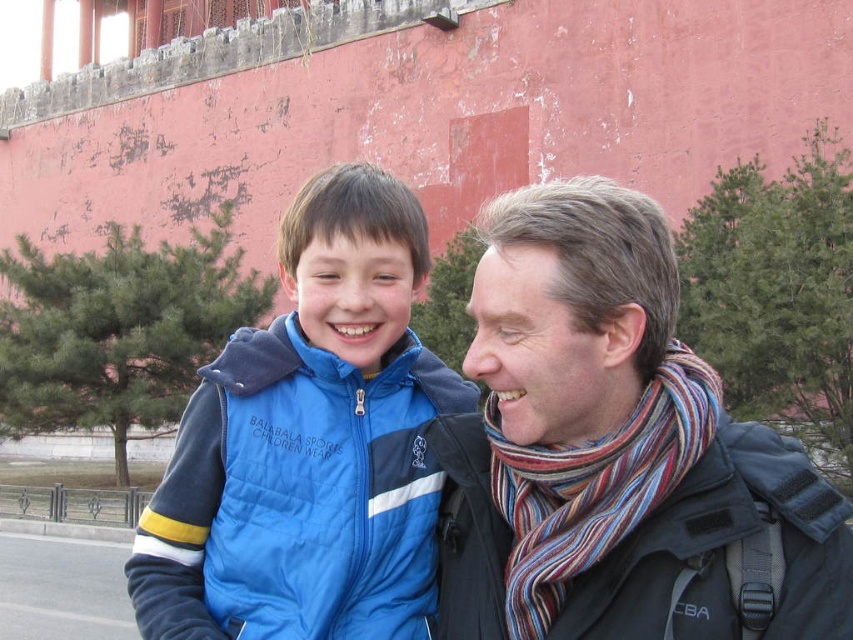
Question: Can you confirm if striped scarf at right is positioned to the right of blue quilted vest at center?

Choices:
 (A) no
 (B) yes

Answer: (B)

Question: Which of the following is the closest to the observer?

Choices:
 (A) (265, 595)
 (B) (608, 435)

Answer: (B)

Question: Considering the relative positions of striped scarf at right and blue quilted vest at center in the image provided, where is striped scarf at right located with respect to blue quilted vest at center?

Choices:
 (A) right
 (B) left

Answer: (A)

Question: Can you confirm if striped scarf at right is positioned above blue quilted vest at center?

Choices:
 (A) no
 (B) yes

Answer: (B)